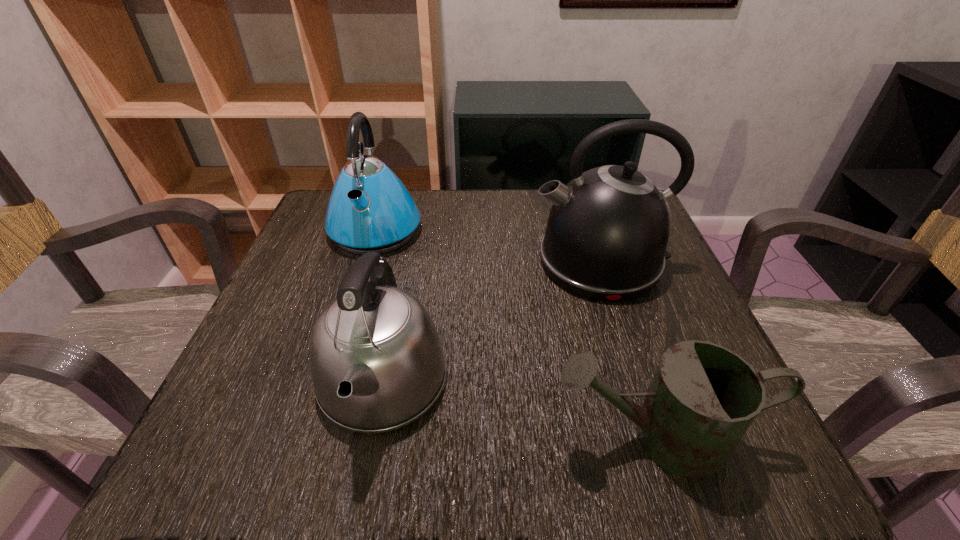
Locate an element on the screen. watering can that is at the near edge is located at coordinates (703, 397).

The image size is (960, 540). What are the coordinates of `kettle that is at the right edge` in the screenshot? It's located at (607, 232).

I want to click on watering can at the right edge, so click(703, 397).

Identify the location of object that is at the far left corner. The width and height of the screenshot is (960, 540). point(370,210).

Locate an element on the screen. The width and height of the screenshot is (960, 540). object present at the near left corner is located at coordinates (376, 359).

Identify the location of object positioned at the far right corner. (607, 232).

Image resolution: width=960 pixels, height=540 pixels. I want to click on object located in the near right corner section of the desktop, so click(703, 397).

Identify the location of vacant space at the far edge. The height and width of the screenshot is (540, 960). (533, 192).

The height and width of the screenshot is (540, 960). Find the location of `vacant space at the left edge of the desktop`. vacant space at the left edge of the desktop is located at coordinates (270, 383).

Image resolution: width=960 pixels, height=540 pixels. In order to click on blank space at the right edge in this screenshot , I will do `click(697, 329)`.